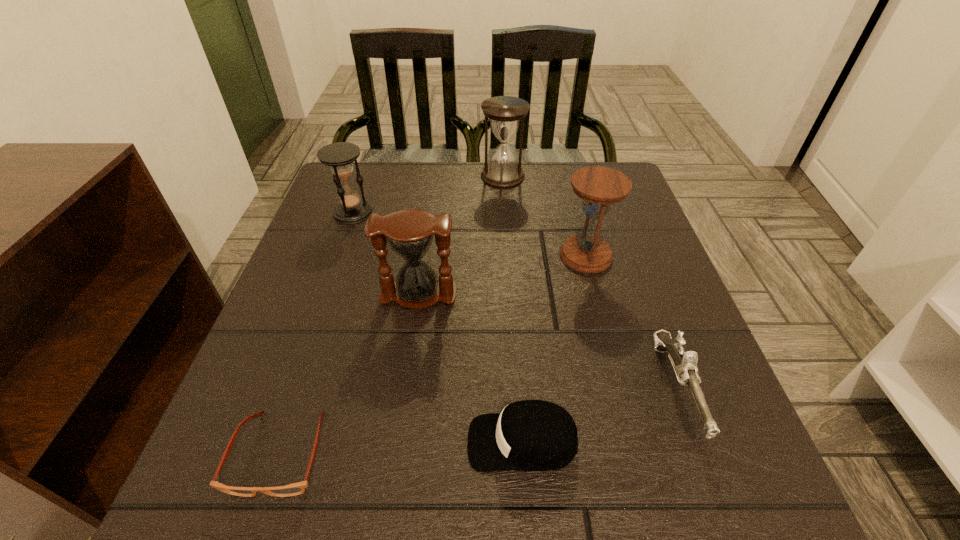
Find the location of a particular element. This screenshot has width=960, height=540. cap at the near edge is located at coordinates (530, 435).

Where is `spectacles that is at the near edge`? spectacles that is at the near edge is located at coordinates (298, 488).

Locate an element on the screen. The image size is (960, 540). hourglass located in the left edge section of the desktop is located at coordinates (339, 156).

The height and width of the screenshot is (540, 960). In order to click on spectacles located in the left edge section of the desktop in this screenshot , I will do `click(298, 488)`.

At what (x,y) coordinates should I click in order to perform the action: click on hourglass located at the right edge. Please return your answer as a coordinate pair (x, y). Looking at the image, I should click on (599, 187).

Identify the location of gun that is at the right edge. Image resolution: width=960 pixels, height=540 pixels. (684, 363).

This screenshot has height=540, width=960. Identify the location of object located at the far left corner. (339, 156).

Where is `object positioned at the near left corner`? This screenshot has width=960, height=540. object positioned at the near left corner is located at coordinates (298, 488).

What are the coordinates of `vacant space at the far edge` in the screenshot? It's located at (557, 201).

Identify the location of vacant area at the near edge. (348, 524).